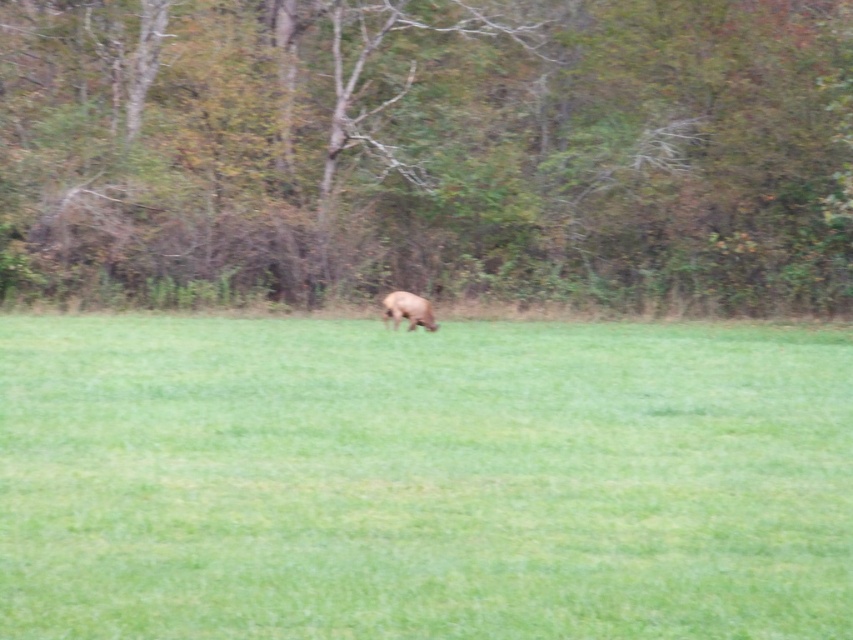
You are standing in the scene and want to take a photo of the deer. The camera you have can focus on objects up to 5 meters away. Is the green grassy field at center within the camera focus range?

The green grassy field at center is 5.48 meters away from the camera, which is beyond the camera focus range of 5 meters. Therefore, the camera cannot focus on the green grassy field at center.

You are a hiker trying to determine which area is larger in the scene. You see the green grassy field at center and the brown leafy tree at center. Which one takes up more space in the image?

The brown leafy tree at center occupies more space than the green grassy field at center according to the description.

You are standing at the origin point in the image. Which direction should you move to reach the green grassy field at center?

The green grassy field at center is located at coordinates point (422, 480), so you should move towards the right and slightly forward to reach it.